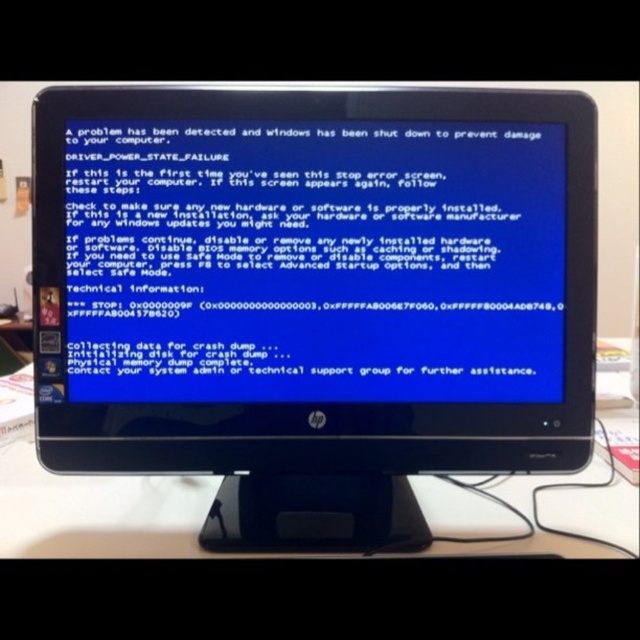
You are setting up a new desk and need to place the black plastic monitor at center on top of the white plastic table at lower center. Can the monitor fit on the table based on their sizes?

The black plastic monitor at center is taller than the white plastic table at lower center, so the monitor cannot fit on the table as it would exceed the table height.

You are setting up a new desk setup and have a black plastic monitor at center and a white plastic table at lower center. Which object is wider?

The black plastic monitor at center is wider than the white plastic table at lower center.